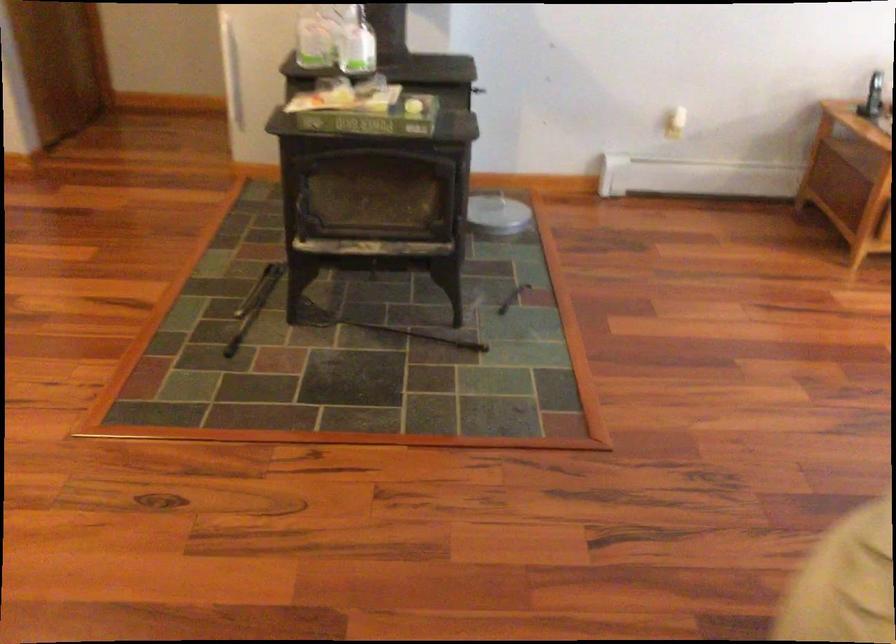
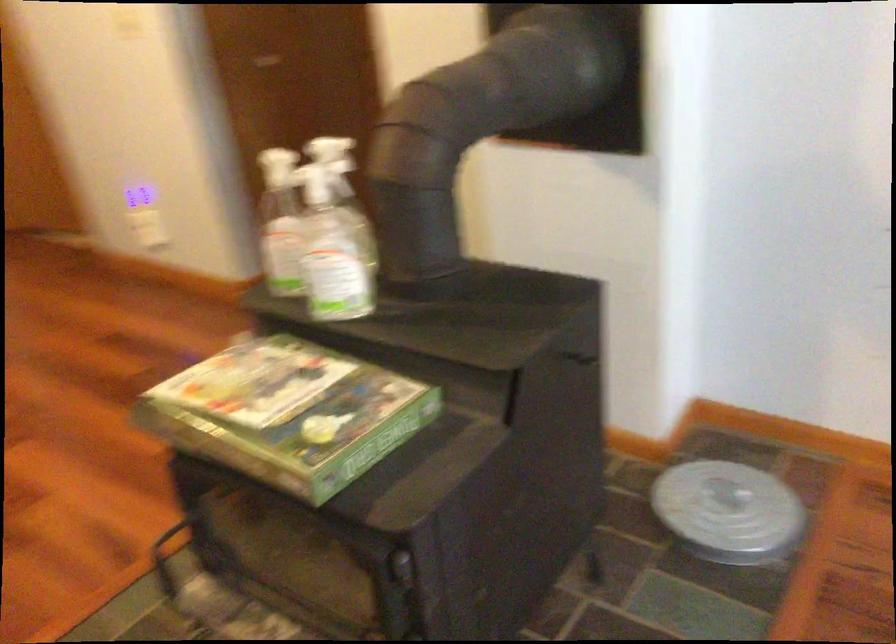
Find the pixel in the second image that matches (x=383, y=105) in the first image.

(289, 413)